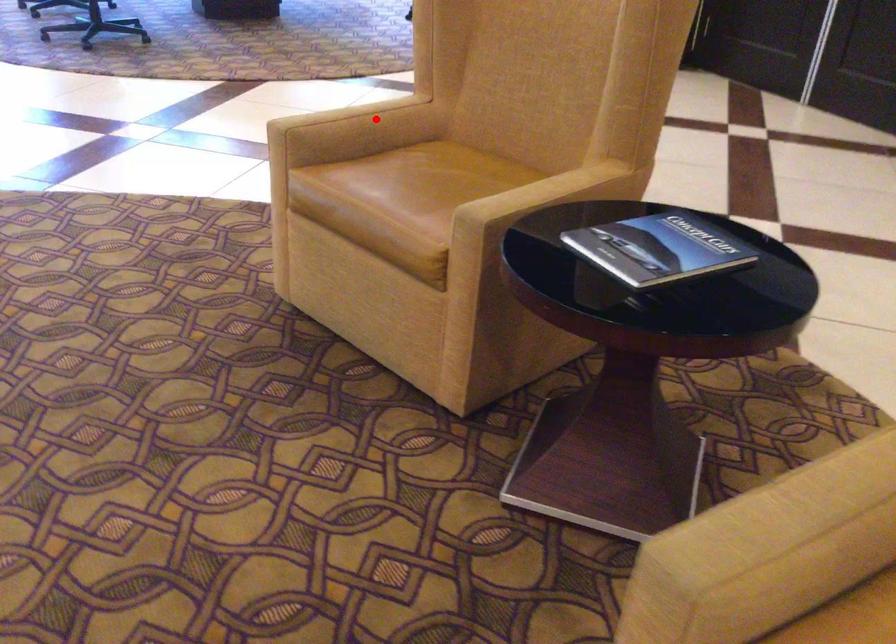
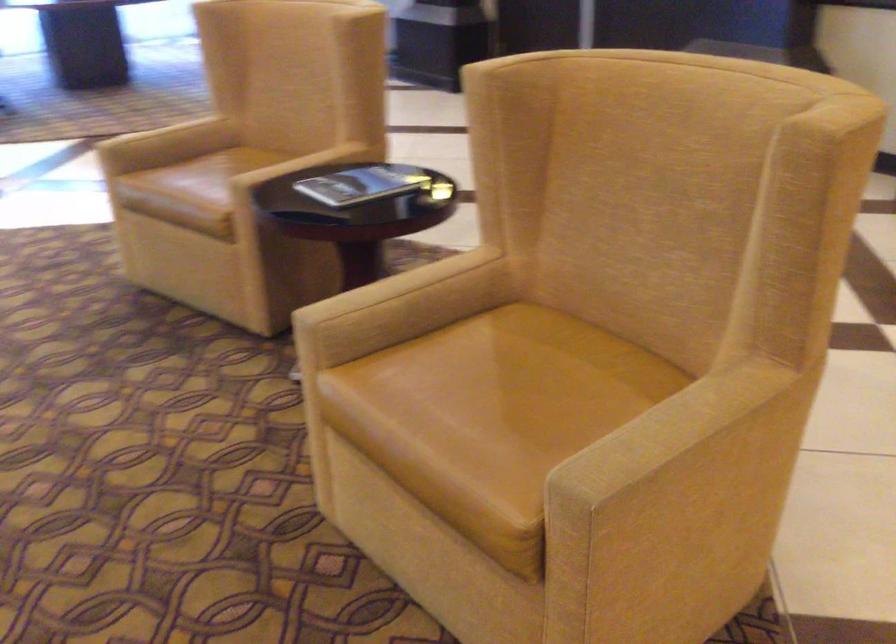
Question: I am providing you with two images of the same scene from different viewpoints. A red point is shown in image1. For the corresponding object point in image2, is it positioned nearer or farther from the camera?

Choices:
 (A) Nearer
 (B) Farther

Answer: (B)